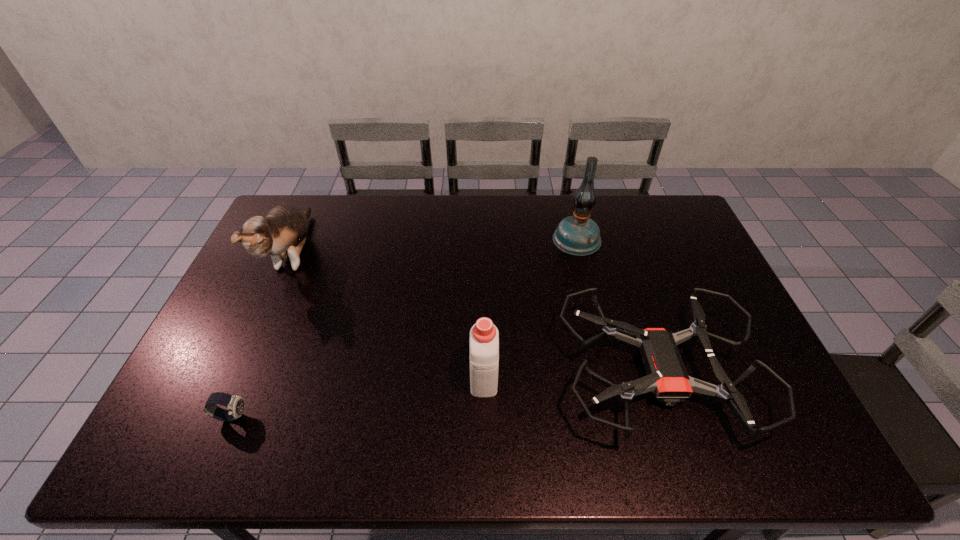
This screenshot has width=960, height=540. I want to click on object that is the fourth closest to the tallest object, so pos(235,404).

Image resolution: width=960 pixels, height=540 pixels. What are the coordinates of `free space that satisfies the following two spatial constraints: 1. on the handle side of the third object from left to right; 2. on the right side of the oil lamp` in the screenshot? It's located at (483, 239).